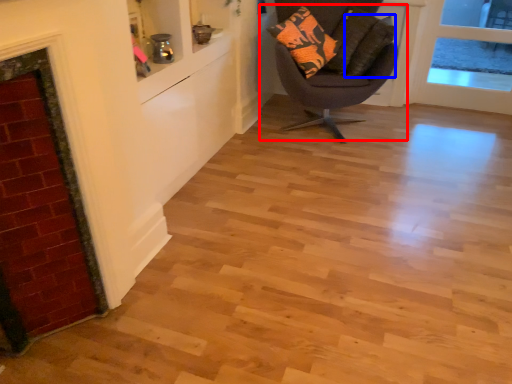
Question: Among these objects, which one is nearest to the camera, chair (highlighted by a red box) or pillow (highlighted by a blue box)?

Choices:
 (A) chair
 (B) pillow

Answer: (A)